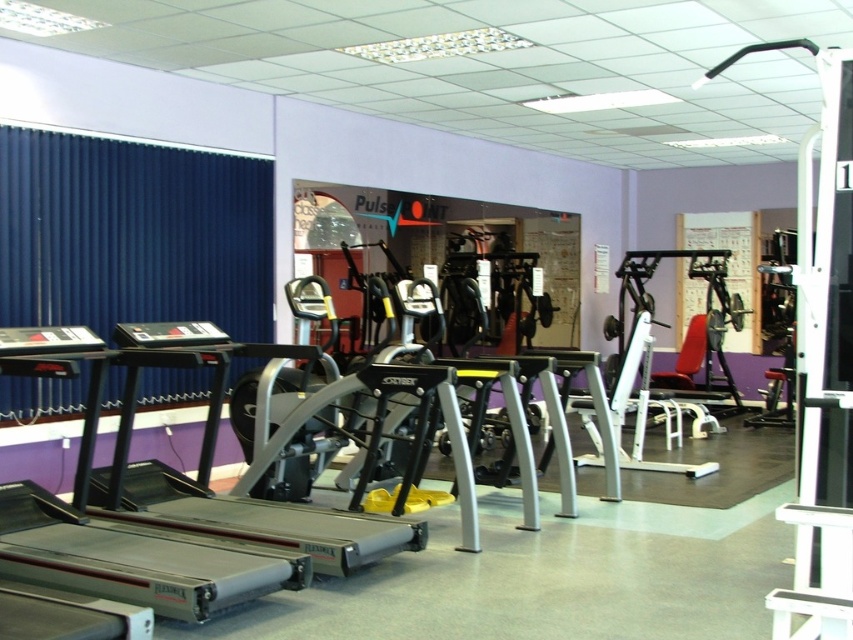
You are standing at the entrance of the gym and see the point marked at coordinates (x=821, y=364). What object is located at this point?

The point at coordinates (x=821, y=364) corresponds to the metallic silver weight machine at right.

You are standing at the entrance of the gym and see the silver metallic treadmill at lower left. If you walk straight ahead, will you reach the treadmill before encountering any other equipment?

The silver metallic treadmill at lower left is located at point (115, 529), which suggests it is positioned closer to the entrance compared to other equipment. Therefore, walking straight ahead would likely lead you to the treadmill before encountering other machines.

Looking at this image, you are planning to place a new elliptical machine in the gym. You have two options for placement areas next to the existing treadmills. One area is next to the silver metallic treadmill at lower left and the other is next to the silver metallic treadmill at center. Which area has more space available for the new elliptical machine?

The area next to the silver metallic treadmill at center has more space available because the silver metallic treadmill at lower left occupies less space than the silver metallic treadmill at center, implying the space next to it is smaller.